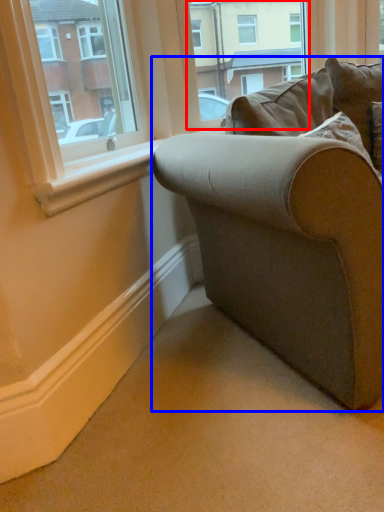
Question: Which object appears closest to the camera in this image, window frame (highlighted by a red box) or studio couch (highlighted by a blue box)?

Choices:
 (A) window frame
 (B) studio couch

Answer: (B)